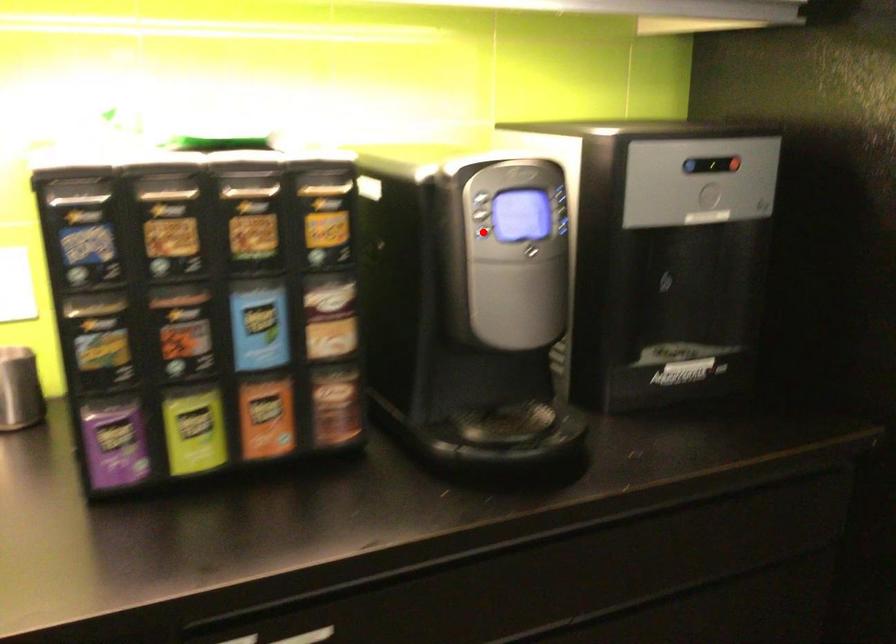
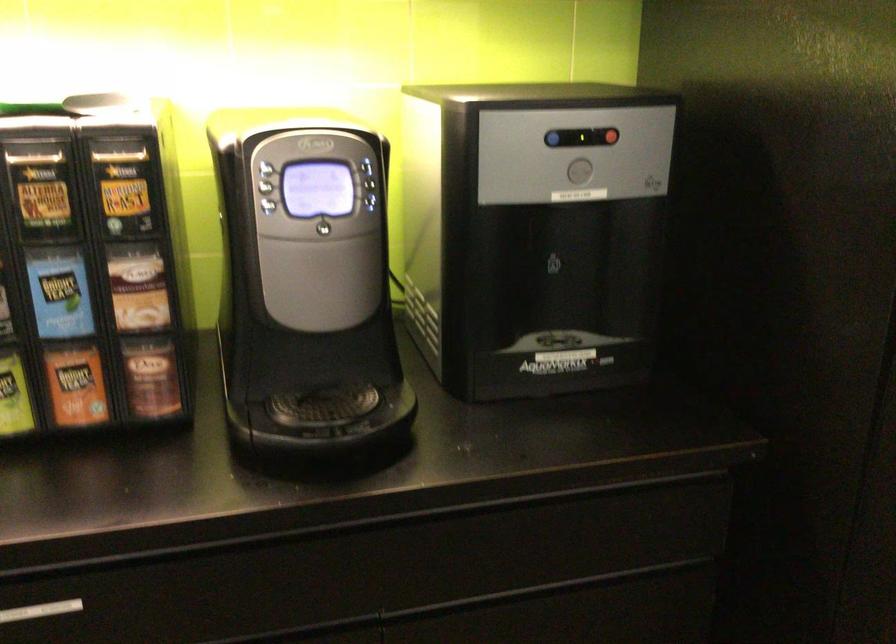
Find the pixel in the second image that matches the highlighted location in the first image.

(268, 205)